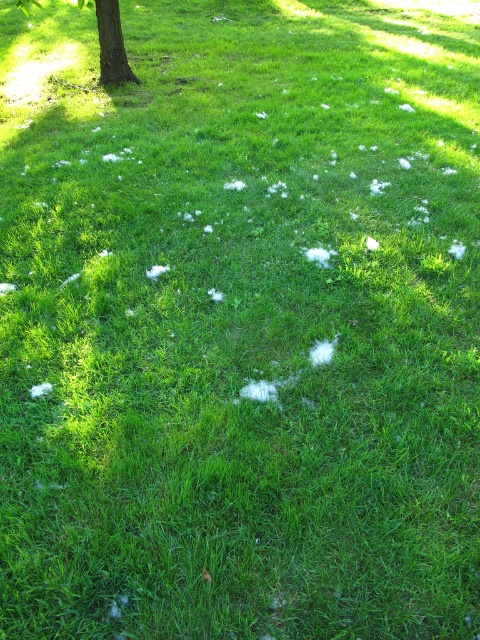
Between brown textured tree at upper left and brown rough bark at upper left, which one has less height?

Standing shorter between the two is brown textured tree at upper left.

Where is `brown textured tree at upper left`? brown textured tree at upper left is located at coordinates click(x=110, y=44).

Is point (110, 29) farther from camera compared to point (109, 6)?

Yes, point (110, 29) is behind point (109, 6).

Identify the location of brown textured tree at upper left. (110, 44).